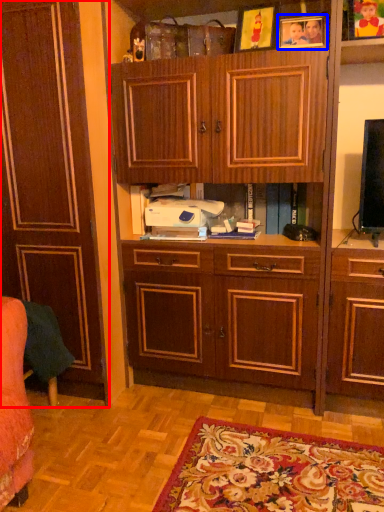
Question: Which of the following is the closest to the observer, cabinetry (highlighted by a red box) or picture frame (highlighted by a blue box)?

Choices:
 (A) cabinetry
 (B) picture frame

Answer: (A)